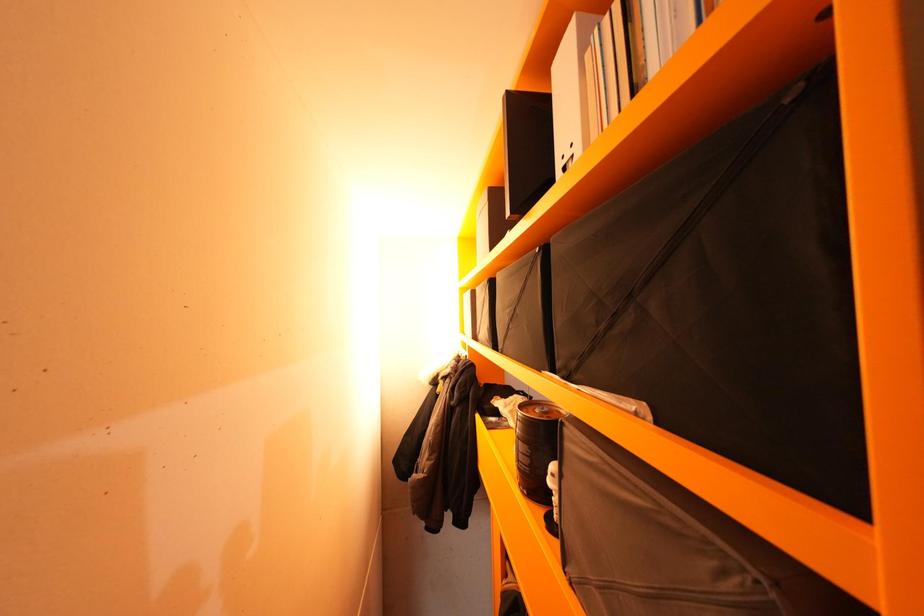
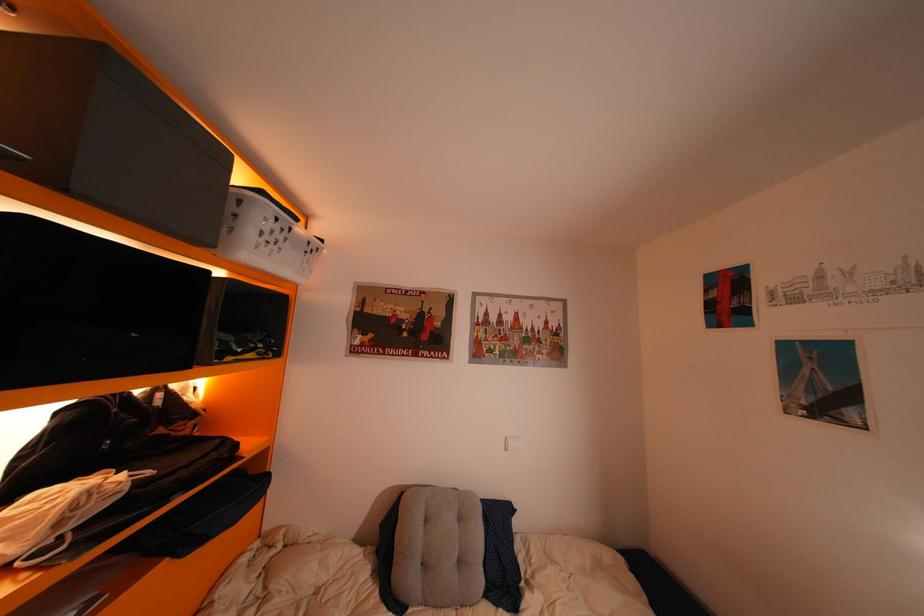
The images are taken continuously from a first-person perspective. In which direction are you moving?

The movement direction of the cameraman is right, forward.